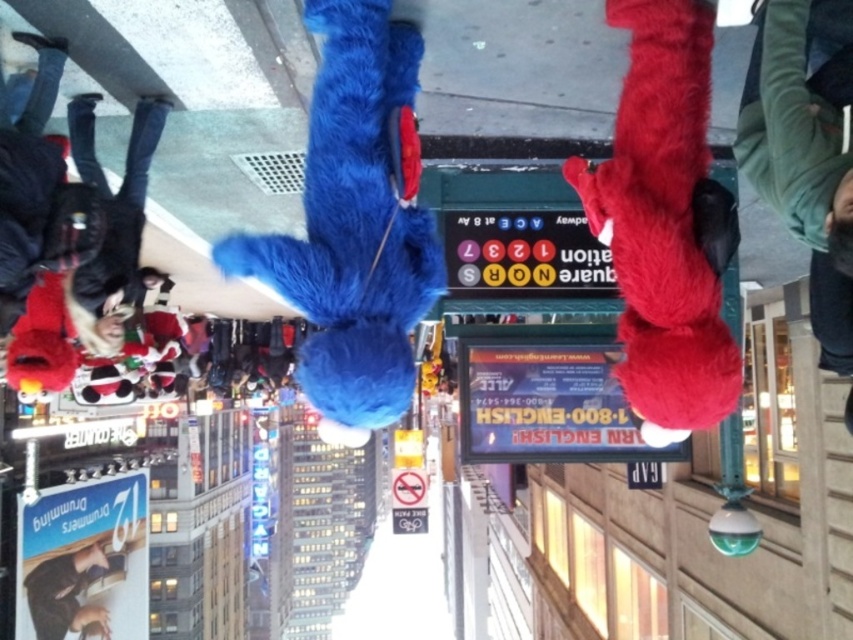
You are an urban planner designing a new public plaza and want to place both the fuzzy blue plush at center and the green fuzzy sweater at upper right in the plaza. Given their sizes, which object should you place closer to the entrance to ensure visitors can easily see both without obstruction?

The fuzzy blue plush at center is wider than the green fuzzy sweater at upper right. To ensure both are visible without obstruction, place the wider fuzzy blue plush at center closer to the entrance so it doesn

You are standing at the top of a building looking down at the busy street below. You see two points marked on the ground. The first point is at coordinates point (402,371) and the second point is at point (35,602). If you were to walk from the first point to the second point, would you be moving towards the street or away from it?

Since point (402,371) is in front of point (35,602), moving from the first point to the second would mean moving away from the street towards the building.